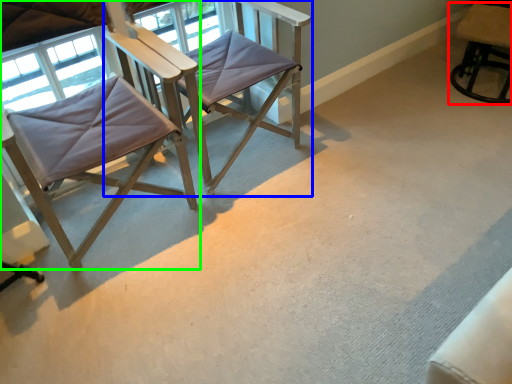
Question: Which object is positioned closest to chair (highlighted by a red box)? Select from chair (highlighted by a blue box) and chair (highlighted by a green box).

Choices:
 (A) chair
 (B) chair

Answer: (A)